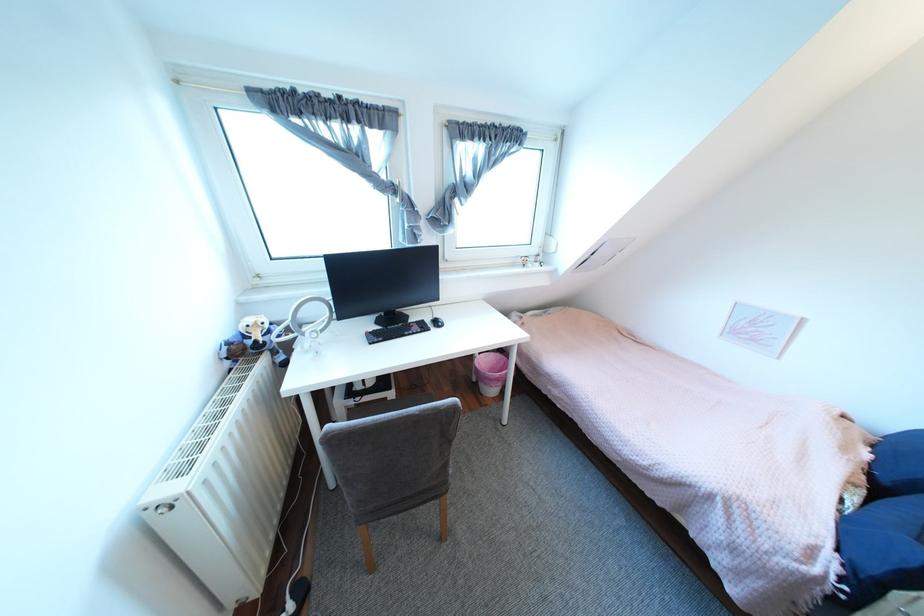
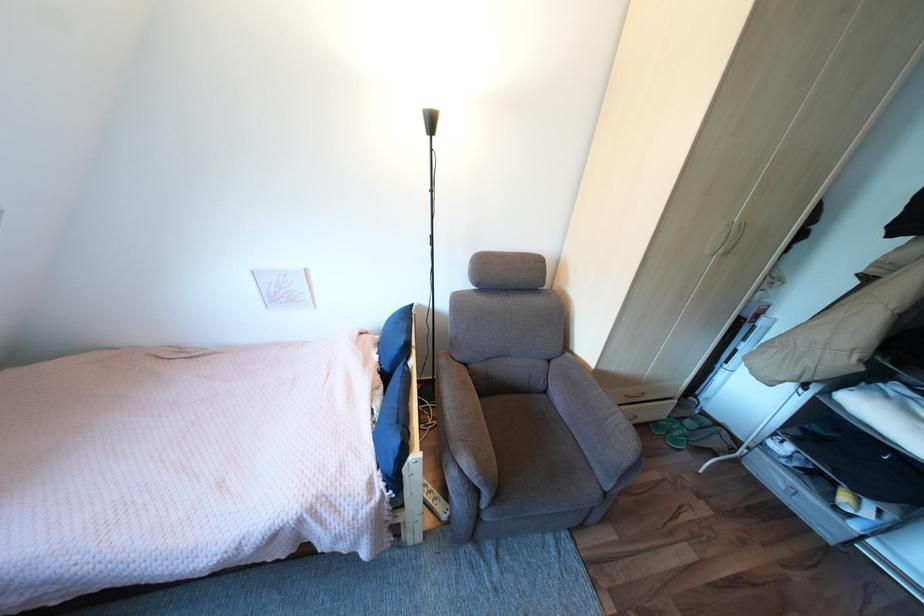
Based on the continuous images, in which direction is the camera rotating?

The camera rotated toward right-down.